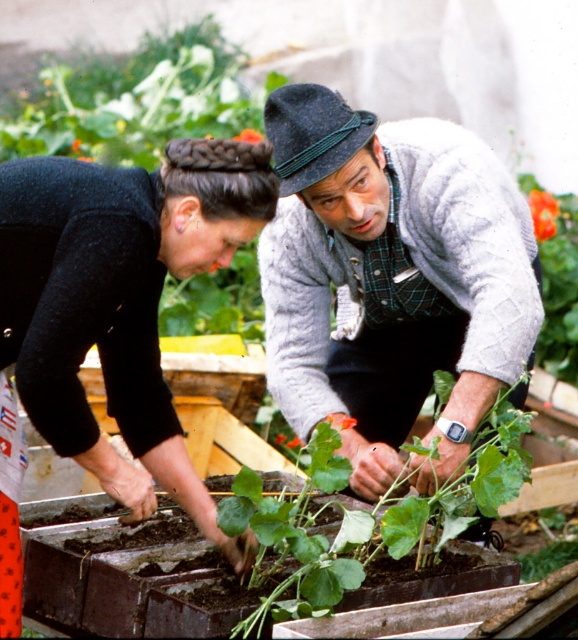
You are a drone operator trying to capture a photo of the gray wool sweater at center and the orange flower at upper right in the same frame. The camera has a maximum range of 3 meters. Can you fit both objects in the frame?

The gray wool sweater at center is 2.66 meters from the orange flower at upper right. Since the distance between them is within the camera maximum range of 3 meters, yes, you can fit both objects in the frame.

What is located at the coordinates point (120, 301)?

The black velvet hair at center is located at point (120, 301).